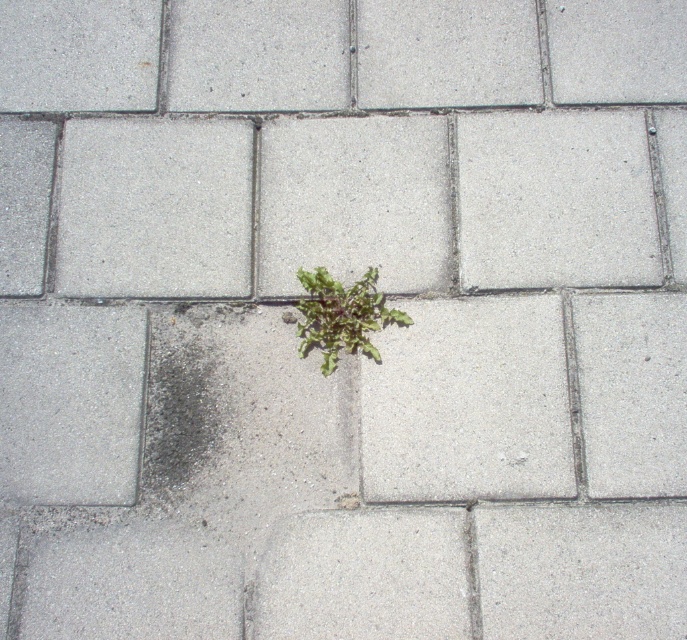
Question: Can you confirm if dark gray gravel at center is positioned below green leafy plant at center?

Choices:
 (A) no
 (B) yes

Answer: (B)

Question: Which object appears farthest from the camera in this image?

Choices:
 (A) green leafy plant at center
 (B) dark gray gravel at center

Answer: (A)

Question: Among these points, which one is farthest from the camera?

Choices:
 (A) (229, 397)
 (B) (337, 298)

Answer: (B)

Question: Does dark gray gravel at center appear on the left side of green leafy plant at center?

Choices:
 (A) no
 (B) yes

Answer: (B)

Question: Can you confirm if dark gray gravel at center is positioned below green leafy plant at center?

Choices:
 (A) no
 (B) yes

Answer: (B)